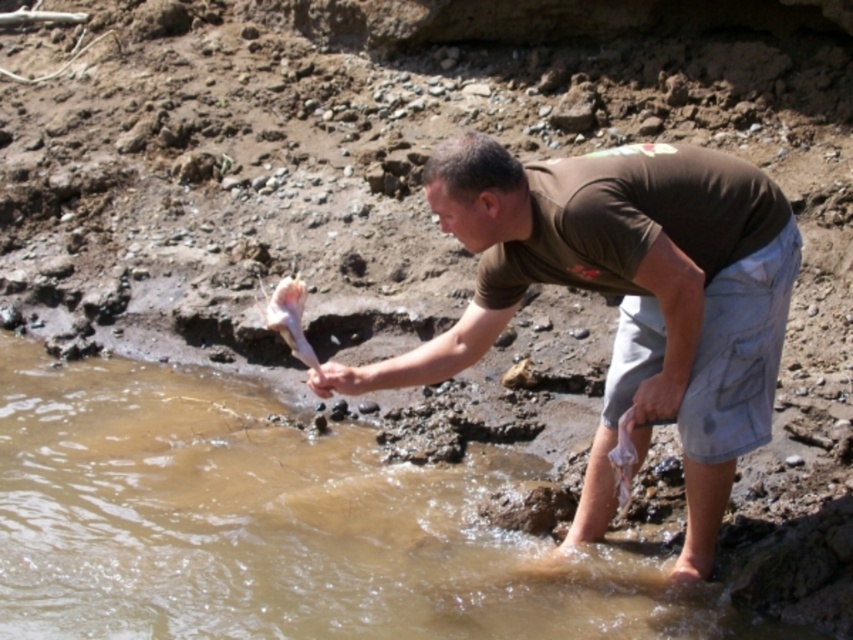
Who is higher up, brown cotton shirt at center or pink flesh at lower left?

pink flesh at lower left is above.

Where is `brown cotton shirt at center`? The image size is (853, 640). brown cotton shirt at center is located at coordinates (625, 300).